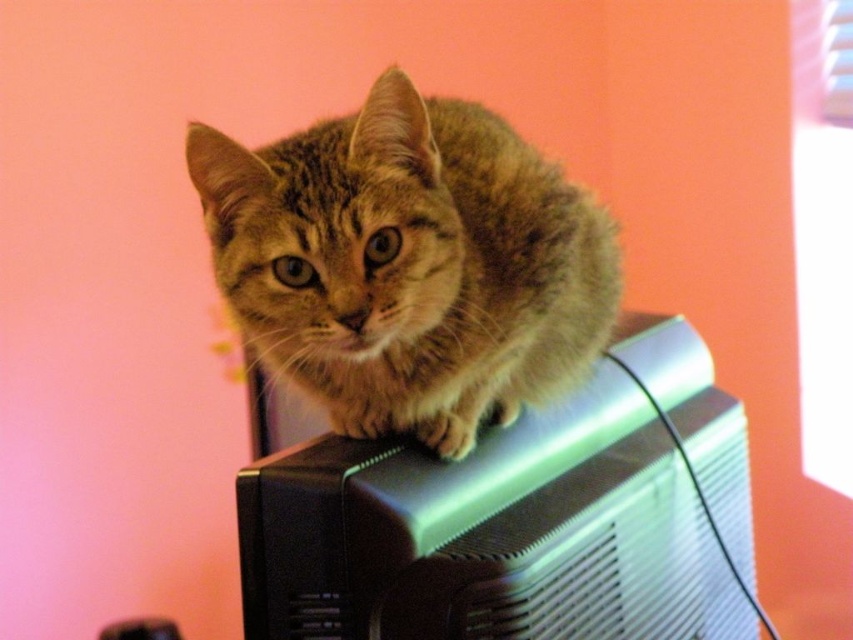
Consider the image. You are standing in a room with a tabby cat on a CRT television set. You notice a point at coordinates (519, 518). What object is located at that point?

The point at coordinates (519, 518) corresponds to the metallic silver computer at upper center.